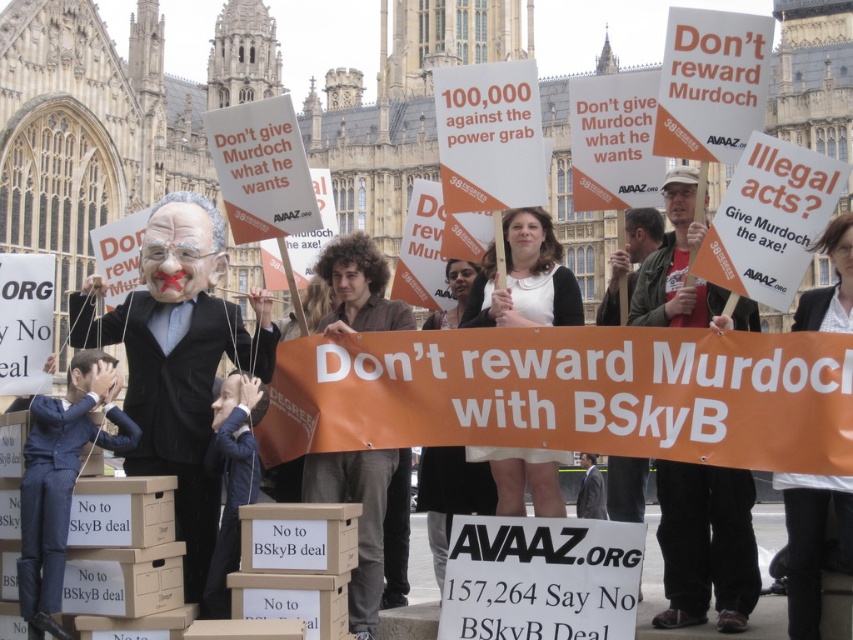
Question: Which point appears closest to the camera in this image?

Choices:
 (A) (306, 500)
 (B) (100, 388)
 (C) (527, 461)
 (D) (827, 552)

Answer: (D)

Question: Is matte black suit at center positioned before blue textured suit at center?

Choices:
 (A) yes
 (B) no

Answer: (B)

Question: Is matte black suit at center to the left of brown fabric shirt at center from the viewer's perspective?

Choices:
 (A) no
 (B) yes

Answer: (B)

Question: Based on their relative distances, which object is nearer to the white paper sign at center?

Choices:
 (A) red shirt at center
 (B) white fabric dress at center

Answer: (A)

Question: Which point is farther from the camera taking this photo?

Choices:
 (A) (177, 294)
 (B) (846, 561)
 (C) (71, 381)

Answer: (A)

Question: Does blue textured suit at center appear under white fabric dress at center?

Choices:
 (A) no
 (B) yes

Answer: (B)